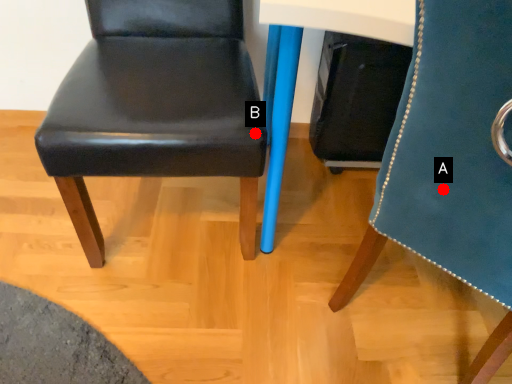
Question: Two points are circled on the image, labeled by A and B beside each circle. Which point is further to the camera?

Choices:
 (A) A is further
 (B) B is further

Answer: (B)